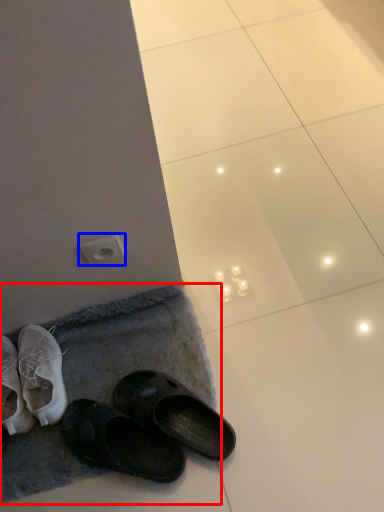
Question: Which object is further to the camera taking this photo, bath mat (highlighted by a red box) or electric outlet (highlighted by a blue box)?

Choices:
 (A) bath mat
 (B) electric outlet

Answer: (A)